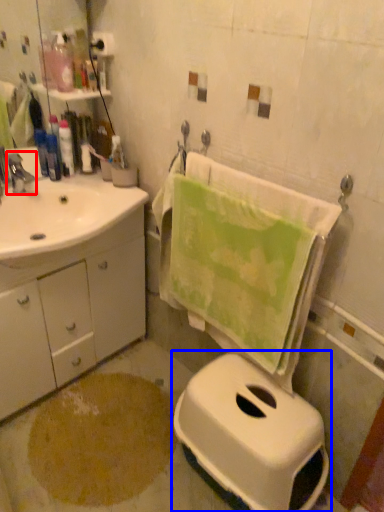
Question: Which object appears closest to the camera in this image, tap (highlighted by a red box) or toilet (highlighted by a blue box)?

Choices:
 (A) tap
 (B) toilet

Answer: (B)